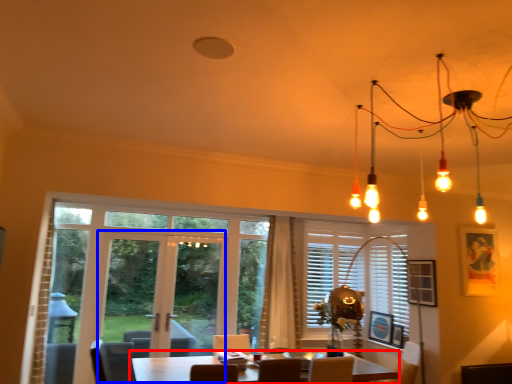
Question: Which point is closer to the camera, table (highlighted by a red box) or screen door (highlighted by a blue box)?

Choices:
 (A) table
 (B) screen door

Answer: (A)